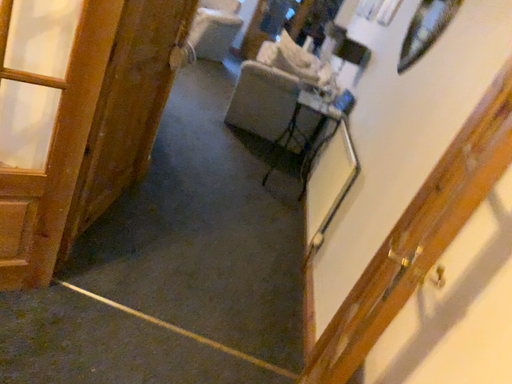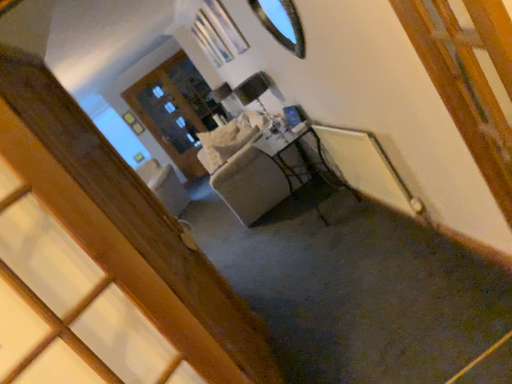
Question: How did the camera likely rotate when shooting the video?

Choices:
 (A) rotated left
 (B) rotated right

Answer: (A)